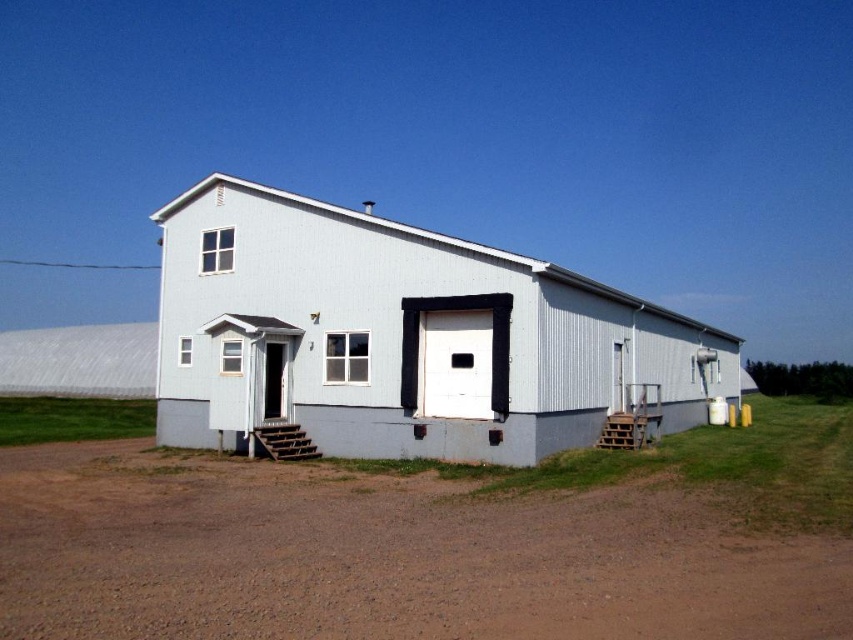
Looking at this image, you are a delivery person standing at the entrance of the building. You need to place a package that requires a 3.5 meter clearance between two structures. Can you safely place the package between the light blue siding at center and the white matte garage door at center?

The light blue siding at center is 4.22 meters away from the white matte garage door at center. Since the required clearance is 3.5 meters, the distance between them is sufficient, so you can safely place the package there.

You are standing at the entrance of the barn and want to walk to the brown dirt field at lower center. Which direction should you go relative to the light blue siding at center?

The brown dirt field at lower center is in front of the light blue siding at center, so you should walk towards the light blue siding at center to reach the brown dirt field at lower center.

You are planning to plant a garden in the brown dirt field at lower center and need to know its size relative to the white matte garage door at center. Can you determine which one is larger?

The brown dirt field at lower center is bigger than the white matte garage door at center according to the description.